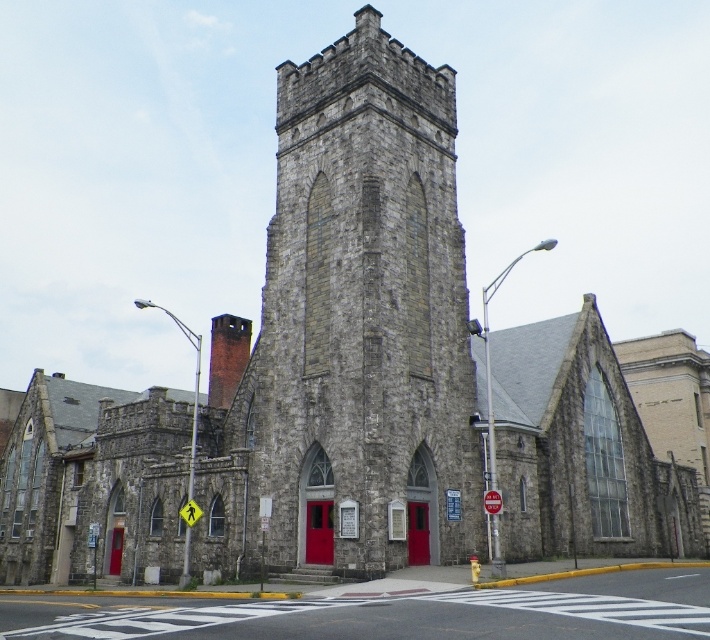
Question: Which object appears closest to the camera in this image?

Choices:
 (A) smooth asphalt road at center
 (B) gray stone tower at center

Answer: (A)

Question: Is gray stone tower at center positioned in front of smooth asphalt road at center?

Choices:
 (A) no
 (B) yes

Answer: (A)

Question: Among these objects, which one is farthest from the camera?

Choices:
 (A) smooth asphalt road at center
 (B) gray stone tower at center

Answer: (B)

Question: Is gray stone tower at center below smooth asphalt road at center?

Choices:
 (A) yes
 (B) no

Answer: (B)

Question: Can you confirm if gray stone tower at center is positioned below smooth asphalt road at center?

Choices:
 (A) no
 (B) yes

Answer: (A)